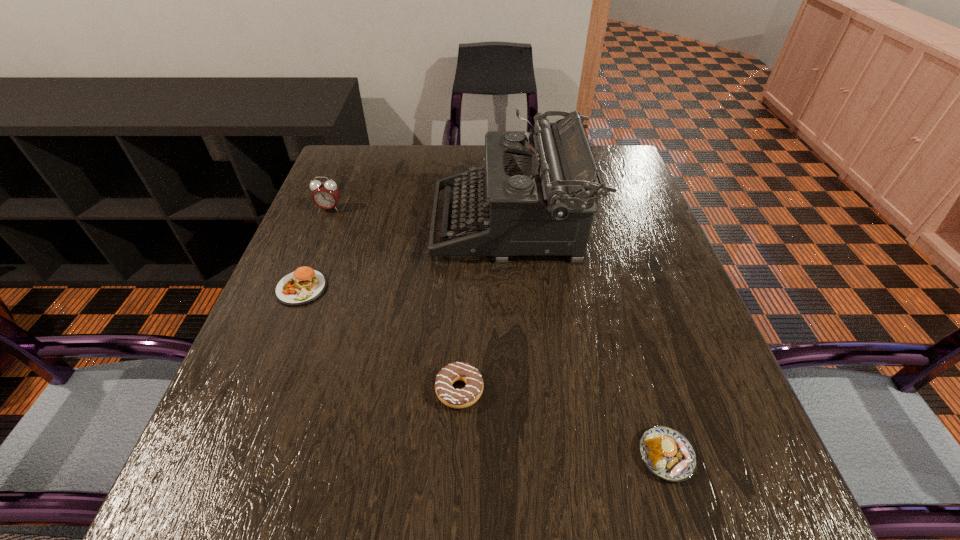
At what (x,y) coordinates should I click in order to perform the action: click on unoccupied area between the typewriter and the pastry. Please return your answer as a coordinate pair (x, y). The width and height of the screenshot is (960, 540). Looking at the image, I should click on (588, 340).

Where is `free space between the nearest object and the typewriter`? Image resolution: width=960 pixels, height=540 pixels. free space between the nearest object and the typewriter is located at coordinates (588, 340).

The image size is (960, 540). I want to click on object identified as the fourth closest to the pastry, so click(x=326, y=194).

Identify which object is the third nearest to the nearest object. Please provide its 2D coordinates. Your answer should be formatted as a tuple, i.e. [(x, y)], where the tuple contains the x and y coordinates of a point satisfying the conditions above.

[(304, 285)]

Locate an element on the screen. This screenshot has width=960, height=540. vacant area in the image that satisfies the following two spatial constraints: 1. on the clock face of the alarm clock; 2. on the right side of the doughnut is located at coordinates (256, 390).

At what (x,y) coordinates should I click in order to perform the action: click on free point that satisfies the following two spatial constraints: 1. on the typing side of the tallest object; 2. on the right side of the nearest object. Please return your answer as a coordinate pair (x, y). Looking at the image, I should click on (527, 455).

Find the location of a particular element. The image size is (960, 540). free location that satisfies the following two spatial constraints: 1. on the typing side of the pastry; 2. on the left side of the typewriter is located at coordinates point(527,455).

Where is `vacant space that satisfies the following two spatial constraints: 1. on the clock face of the fourth shortest object; 2. on the left side of the doughnut`? vacant space that satisfies the following two spatial constraints: 1. on the clock face of the fourth shortest object; 2. on the left side of the doughnut is located at coordinates (256, 390).

Where is `free space that satisfies the following two spatial constraints: 1. on the typing side of the nearest object; 2. on the right side of the tallest object`? Image resolution: width=960 pixels, height=540 pixels. free space that satisfies the following two spatial constraints: 1. on the typing side of the nearest object; 2. on the right side of the tallest object is located at coordinates point(527,455).

The height and width of the screenshot is (540, 960). What are the coordinates of `free space in the image that satisfies the following two spatial constraints: 1. on the clock face of the alarm clock; 2. on the right side of the third tallest object` in the screenshot? It's located at (298, 288).